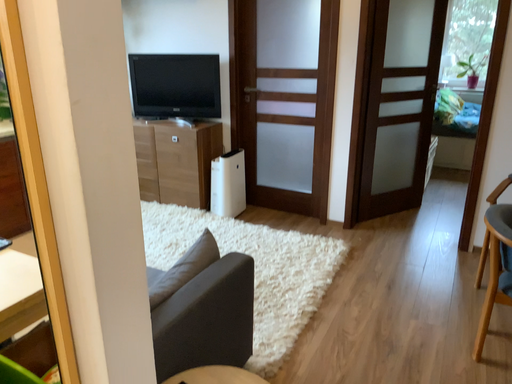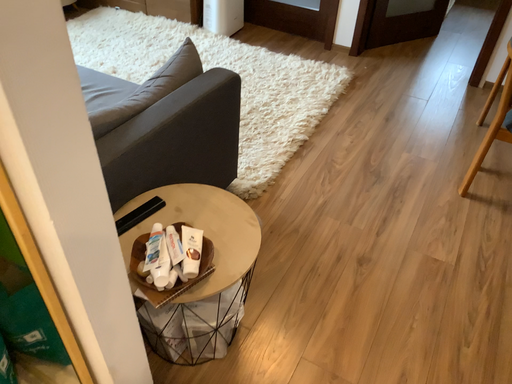
Question: How did the camera likely rotate when shooting the video?

Choices:
 (A) rotated downward
 (B) rotated upward

Answer: (A)